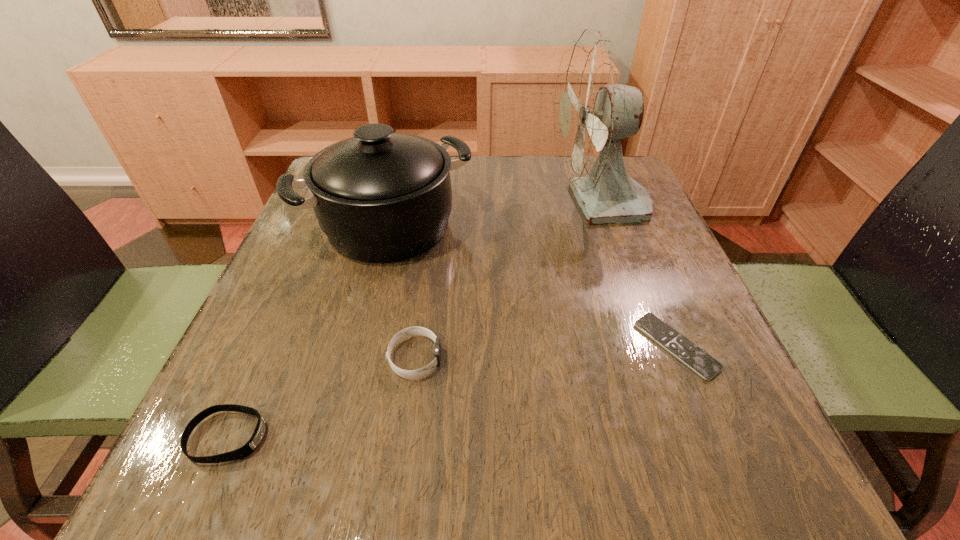
Locate an element on the screen. This screenshot has height=540, width=960. the tallest object is located at coordinates (593, 110).

At what (x,y) coordinates should I click in order to perform the action: click on saucepan. Please return your answer as a coordinate pair (x, y). Image resolution: width=960 pixels, height=540 pixels. Looking at the image, I should click on (380, 197).

The width and height of the screenshot is (960, 540). What are the coordinates of `the taller wristband` in the screenshot? It's located at (410, 331).

Locate an element on the screen. the farther wristband is located at coordinates (410, 331).

What are the coordinates of `the nearest object` in the screenshot? It's located at (251, 445).

The height and width of the screenshot is (540, 960). In order to click on the fourth tallest object in this screenshot , I will do `click(251, 445)`.

You are a GUI agent. You are given a task and a screenshot of the screen. Output one action in this format:
    pyautogui.click(x=<x>, y=<y>)
    Task: Click on the remote control
    
    Given the screenshot: What is the action you would take?
    [696, 359]

At what (x,y) coordinates should I click in order to perform the action: click on free space located in front of the tallest object to blow air. Please return your answer as a coordinate pair (x, y). Looking at the image, I should click on (442, 204).

This screenshot has height=540, width=960. In order to click on vacant space located in front of the tallest object to blow air in this screenshot , I will do `click(396, 204)`.

You are a GUI agent. You are given a task and a screenshot of the screen. Output one action in this format:
    pyautogui.click(x=<x>, y=<y>)
    Task: Click on the vacant point located 0.090m in front of the tallest object to blow air
    Image resolution: width=960 pixels, height=540 pixels.
    Given the screenshot: What is the action you would take?
    pyautogui.click(x=513, y=204)